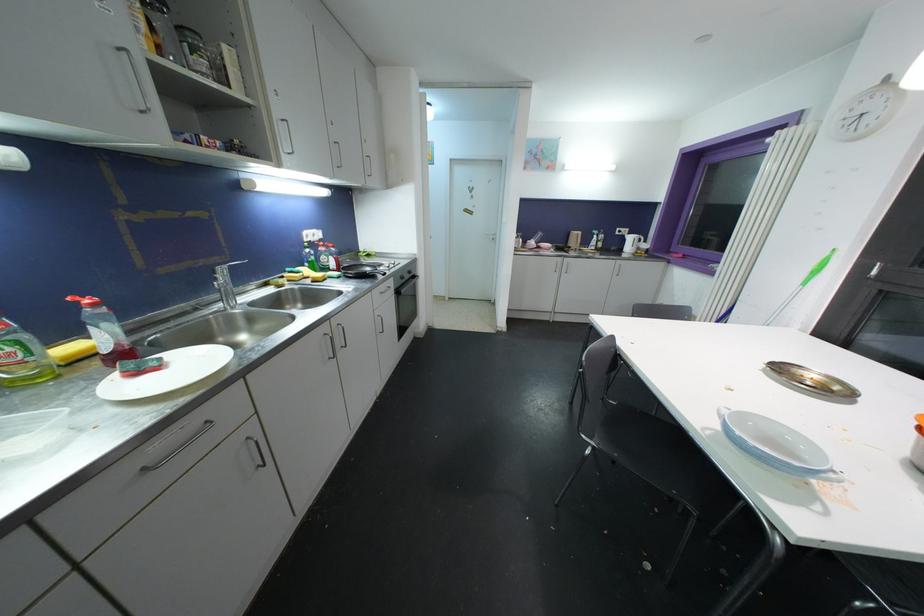
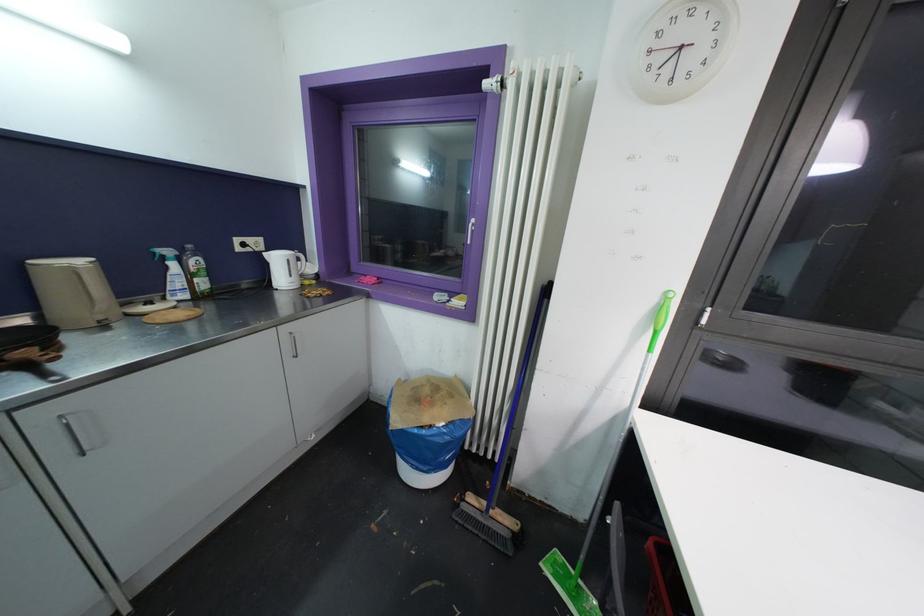
Locate, in the second image, the point that corresponds to (x=634, y=241) in the first image.

(281, 262)